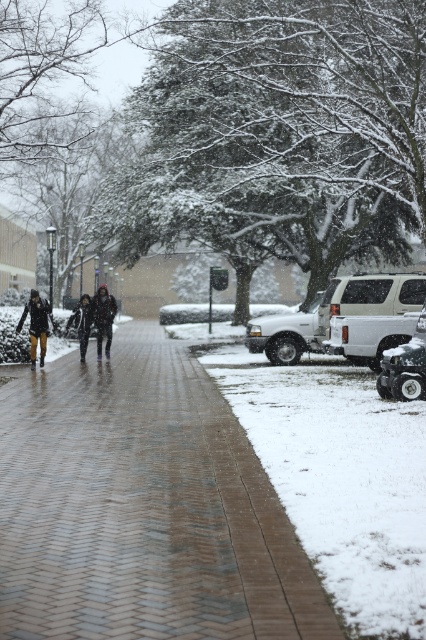
Question: Which point is farther to the camera?

Choices:
 (A) (103, 307)
 (B) (180, 625)
 (C) (69, 324)
 (D) (400, 289)

Answer: (C)

Question: Does white matte suv at right appear under dark gray wool coat at center?

Choices:
 (A) yes
 (B) no

Answer: (A)

Question: Observing the image, what is the correct spatial positioning of white matte suv at right in reference to dark gray wool coat at center?

Choices:
 (A) left
 (B) right

Answer: (B)

Question: Does dark gray wool coat at center appear under dark gray fabric jacket at center?

Choices:
 (A) no
 (B) yes

Answer: (B)

Question: Which object appears farthest from the camera in this image?

Choices:
 (A) white powdery snow at lower right
 (B) brick paved walkway at center
 (C) white matte truck at right
 (D) dark gray wool coat at center

Answer: (D)

Question: Which of the following is the farthest from the observer?

Choices:
 (A) (83, 340)
 (B) (408, 280)
 (C) (111, 333)
 (D) (34, 342)

Answer: (C)